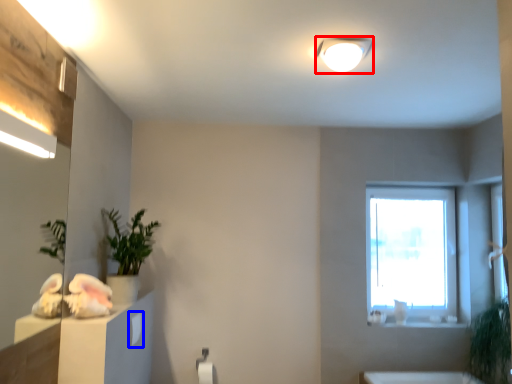
Question: Which object is further to the camera taking this photo, light fixture (highlighted by a red box) or drawer (highlighted by a blue box)?

Choices:
 (A) light fixture
 (B) drawer

Answer: (B)